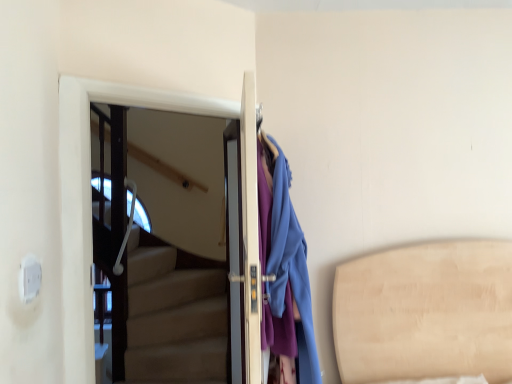
Question: Does white glossy door at upper left, the 2th door from the right, come behind matte white door at center, acting as the 1th door starting from the right?

Choices:
 (A) no
 (B) yes

Answer: (B)

Question: From a real-world perspective, is white glossy door at upper left, the 2th door from the right, physically above matte white door at center, acting as the 1th door starting from the right?

Choices:
 (A) yes
 (B) no

Answer: (A)

Question: Can you confirm if white glossy door at upper left, placed as the first door when sorted from left to right, is thinner than matte white door at center, which ranks as the 2th door in left-to-right order?

Choices:
 (A) no
 (B) yes

Answer: (B)

Question: From the image's perspective, is white glossy door at upper left, the 2th door from the right, under matte white door at center, acting as the 1th door starting from the right?

Choices:
 (A) no
 (B) yes

Answer: (A)

Question: Is white glossy door at upper left, placed as the first door when sorted from left to right, at the left side of matte white door at center, acting as the 1th door starting from the right?

Choices:
 (A) yes
 (B) no

Answer: (A)

Question: Is white glossy door at upper left, the 2th door from the right, outside of matte white door at center, acting as the 1th door starting from the right?

Choices:
 (A) yes
 (B) no

Answer: (A)

Question: From the image's perspective, is white glossy door at upper left, placed as the first door when sorted from left to right, below matte blue coat at right?

Choices:
 (A) yes
 (B) no

Answer: (B)

Question: Does white glossy door at upper left, the 2th door from the right, have a larger size compared to matte blue coat at right?

Choices:
 (A) no
 (B) yes

Answer: (A)

Question: Can you confirm if white glossy door at upper left, placed as the first door when sorted from left to right, is wider than matte blue coat at right?

Choices:
 (A) yes
 (B) no

Answer: (B)

Question: Is the position of white glossy door at upper left, placed as the first door when sorted from left to right, less distant than that of matte blue coat at right?

Choices:
 (A) no
 (B) yes

Answer: (A)

Question: Does white glossy door at upper left, the 2th door from the right, appear on the left side of matte blue coat at right?

Choices:
 (A) no
 (B) yes

Answer: (B)

Question: Is white glossy door at upper left, placed as the first door when sorted from left to right, touching matte blue coat at right?

Choices:
 (A) yes
 (B) no

Answer: (B)

Question: Is matte blue coat at right at the right side of white glossy door at upper left, placed as the first door when sorted from left to right?

Choices:
 (A) yes
 (B) no

Answer: (A)